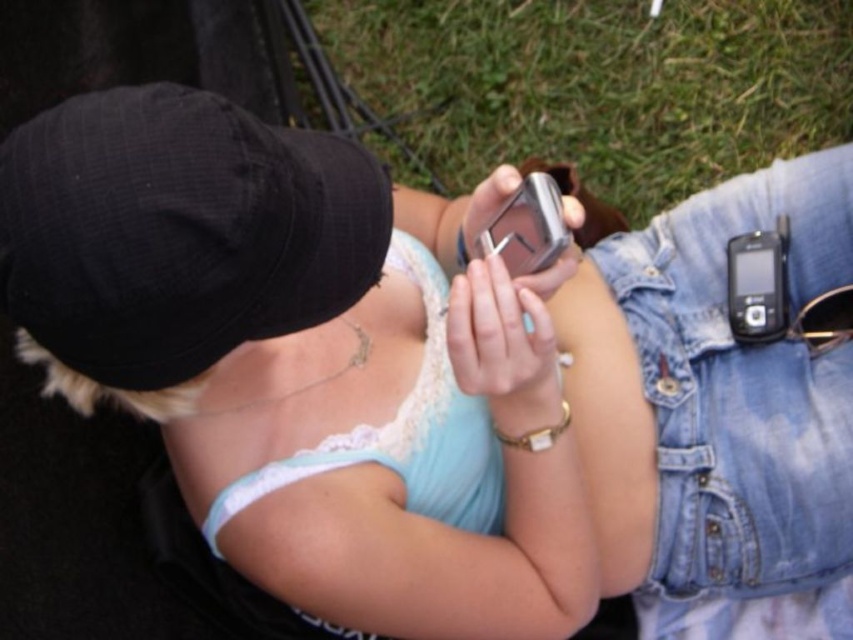
Question: Which point is closer to the camera?

Choices:
 (A) green grass at center
 (B) black plastic smartphone at lower right

Answer: (B)

Question: Which of the following is the closest to the observer?

Choices:
 (A) (730, 156)
 (B) (135, 243)
 (C) (293, 476)
 (D) (508, 250)

Answer: (B)

Question: Is denim at right below black plastic smartphone at lower right?

Choices:
 (A) yes
 (B) no

Answer: (A)

Question: Can you confirm if denim at right is smaller than silver metallic phone at center?

Choices:
 (A) yes
 (B) no

Answer: (B)

Question: Does black plastic smartphone at lower right have a larger size compared to silver metallic phone at center?

Choices:
 (A) no
 (B) yes

Answer: (A)

Question: Which object is positioned farthest from the green grass at center?

Choices:
 (A) black fabric baseball cap at upper left
 (B) black plastic smartphone at lower right

Answer: (A)